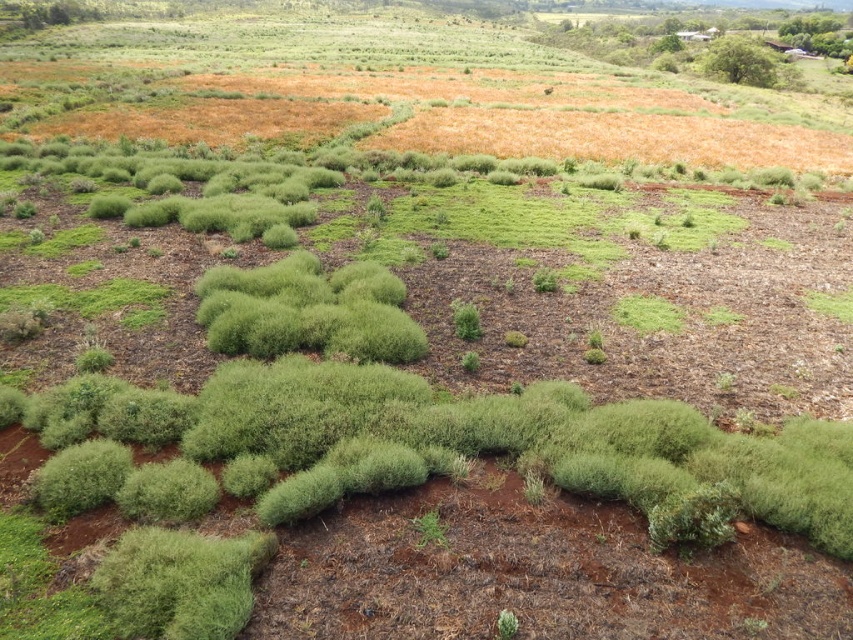
You are standing at the origin point of the coordinate system. You want to walk towards the green leafy bush at upper right. What direction should you face to walk straight towards it?

The green leafy bush at upper right is located at coordinate point (738, 61). Since the x coordinate is 0.098 and y is 0.866, this means it is in the upper right direction from your current position at the origin. Therefore, you should face the upper right direction to walk straight towards it.

You are a hiker who needs to navigate from the green leafy bush at upper right to the green fuzzy bush at center. Given that your average walking pace is 1.5 meters per second, how many seconds will it take you to walk directly between them?

The distance between the green leafy bush at upper right and the green fuzzy bush at center is 94.64 meters. At a pace of 1.5 meters per second, dividing 94.64 by 1.5 gives approximately 63.09 seconds. Therefore, it will take roughly 63 seconds to walk directly between them.

You are standing at the center of the landscape and see the green leafy bush at upper right and the green fuzzy bush at center. Which bush is positioned to the right side of the other?

The green leafy bush at upper right is positioned to the right of the green fuzzy bush at center.